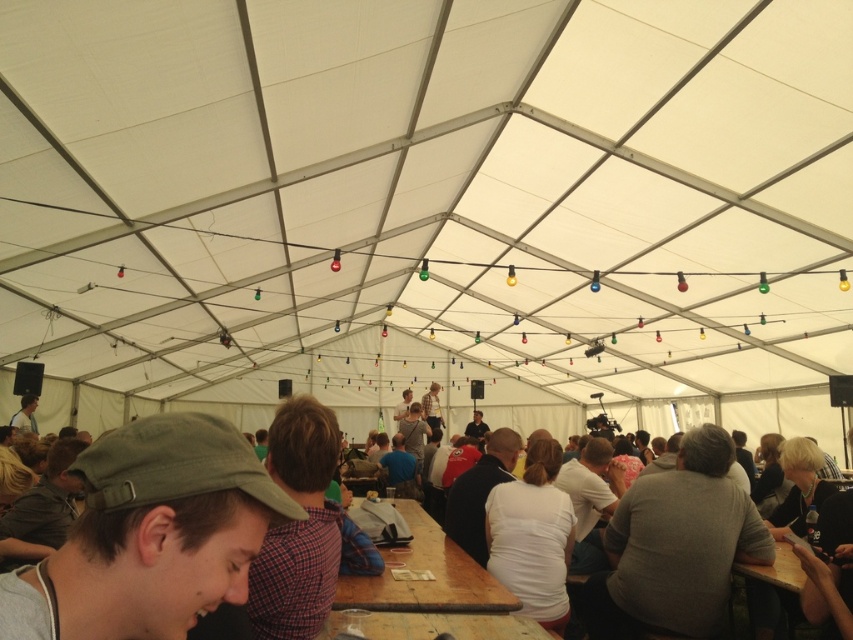
You are a server at the event and need to deliver a drink to the person wearing the gray matte shirt at center. The drink is currently on the wooden table at center. Which direction should you move the drink to reach the person?

The gray matte shirt at center is positioned on the right side of the wooden table at center, so you should move the drink to the right side of the wooden table at center to reach the person.